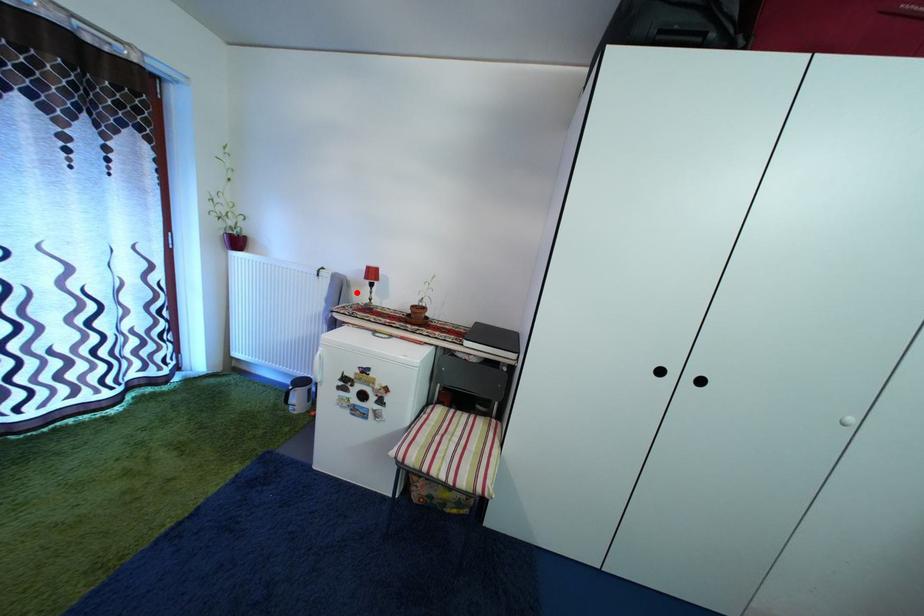
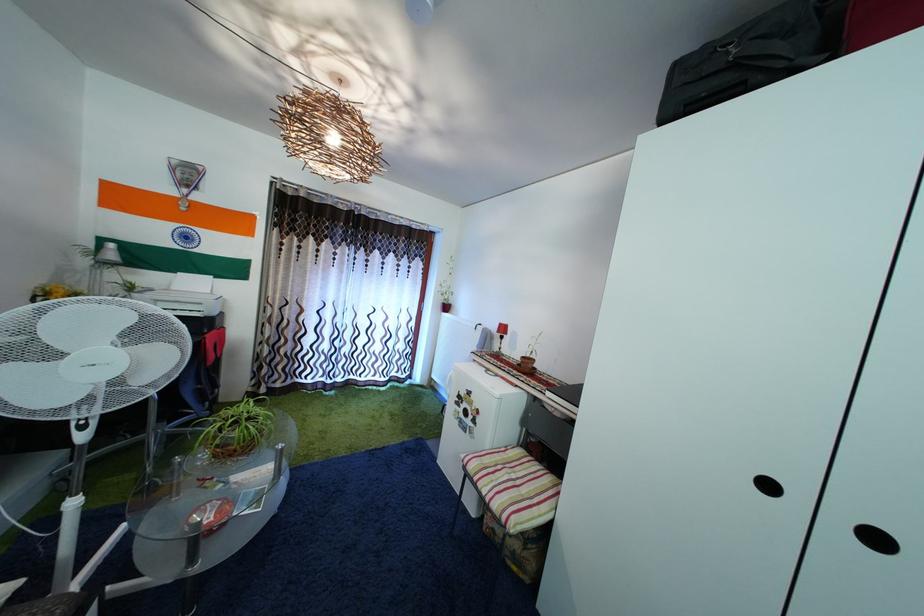
The point at the highlighted location is marked in the first image. Where is the corresponding point in the second image?

(500, 345)